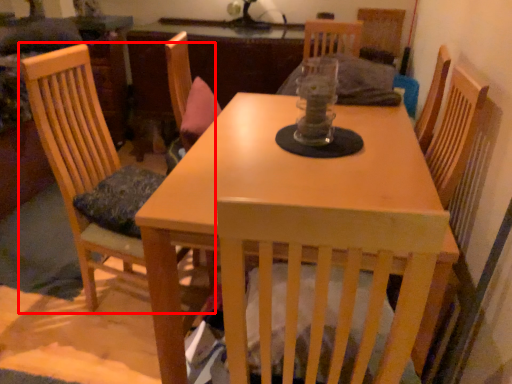
Question: Considering the relative positions of chair (annotated by the red box) and table in the image provided, where is chair (annotated by the red box) located with respect to the staircase?

Choices:
 (A) right
 (B) left

Answer: (B)